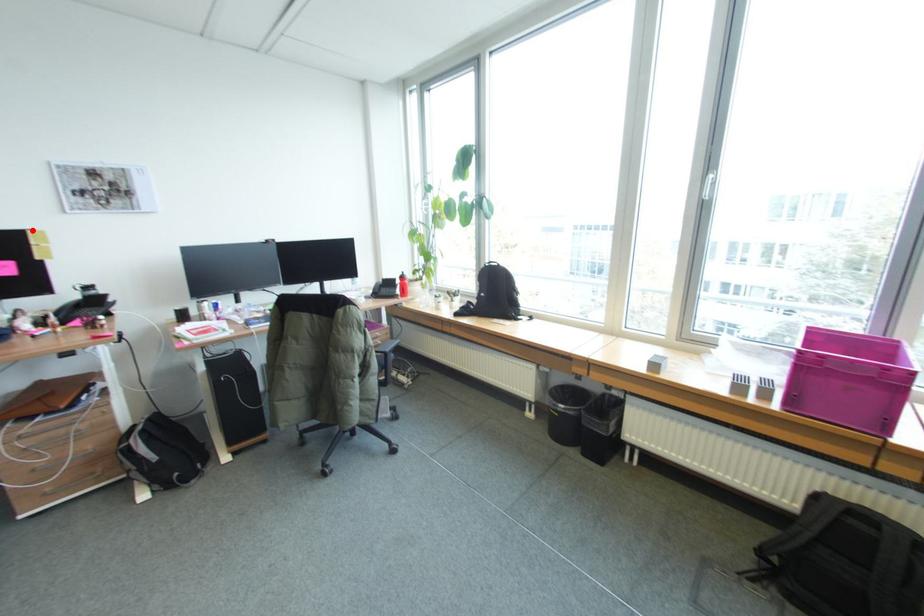
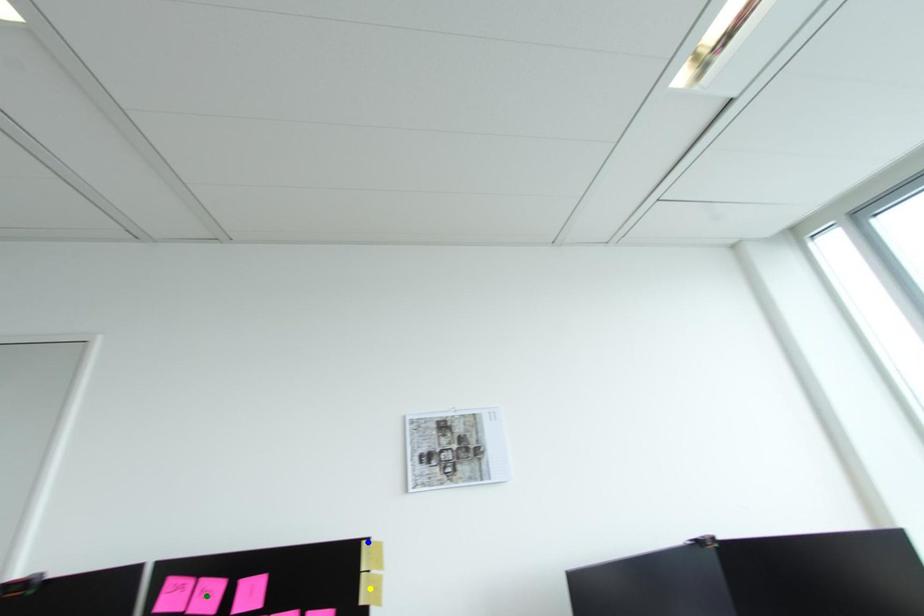
Question: I am providing you with two images of the same scene from different viewpoints. A red point is marked on the first image. You are given multiple points on the second image. Which point in image 2 represents the same 3d spot as the red point in image 1?

Choices:
 (A) yellow point
 (B) blue point
 (C) green point

Answer: (B)